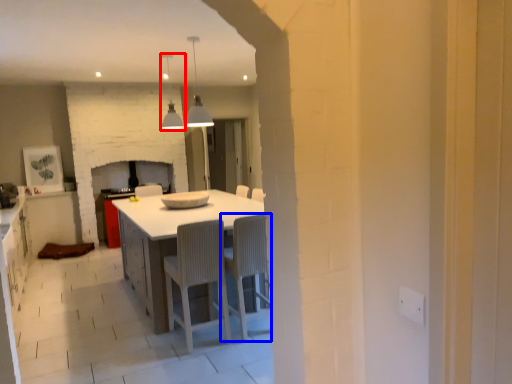
Question: Which point is further to the camera, light fixture (highlighted by a red box) or chair (highlighted by a blue box)?

Choices:
 (A) light fixture
 (B) chair

Answer: (A)